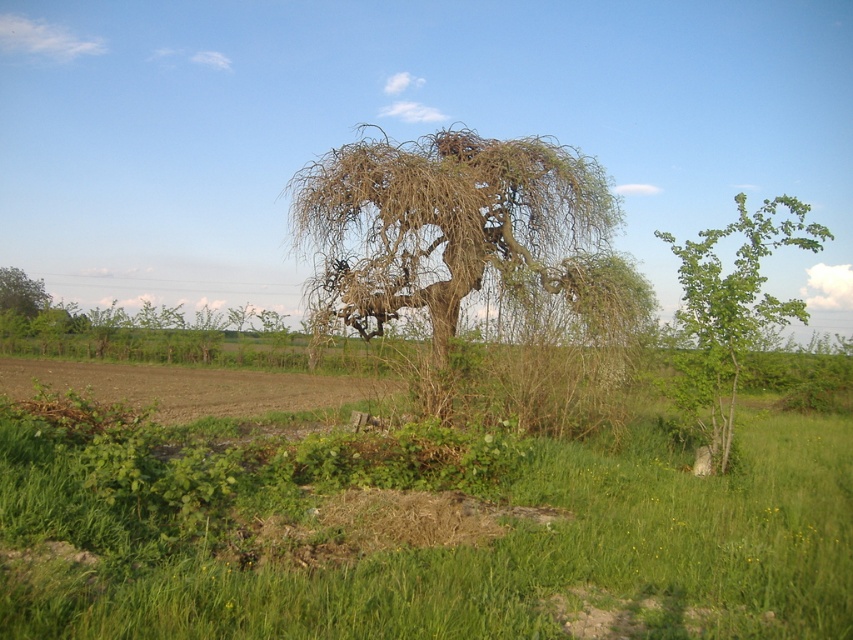
You are standing at the center of the image and want to walk towards the green leafy tree at right. Based on its 2D coordinates, in which cardinal direction should you head?

The green leafy tree at right is located at coordinates 0.481 on the x axis and 0.859 on the y axis. Since the x value is less than 0.5, it means the tree is positioned to the left side of the image. Therefore, you should head west to reach it.

You are standing in the rural landscape scene and want to walk from point A to point B. Point A is located at point (x=403, y=577), and point B is at point (x=767, y=212). Since you want to take the shortest path possible, which point should you start walking from?

You should start walking from point A at (x=403, y=577) because it is closer to the viewer than point B at (x=767, y=212), so the shortest path would be from the closer point to the farther one.